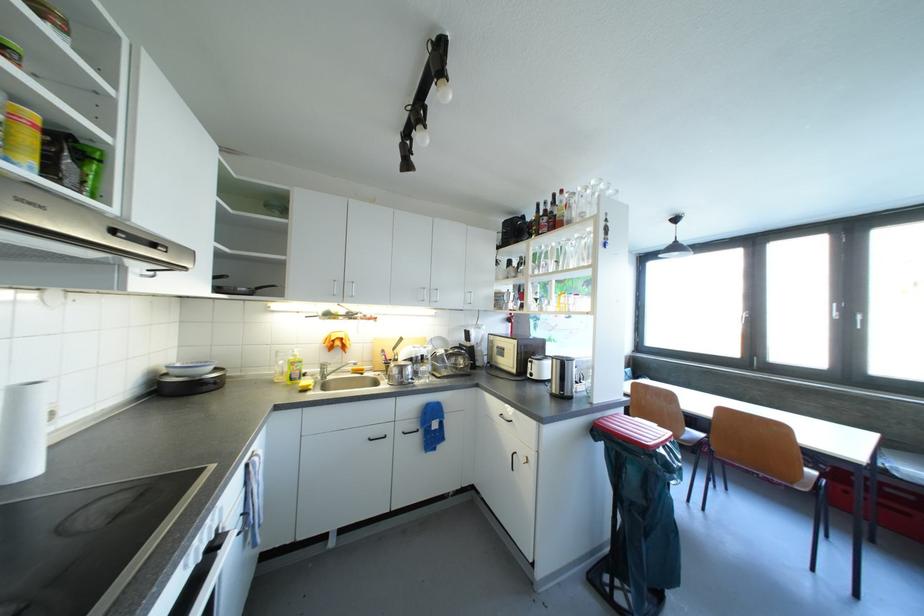
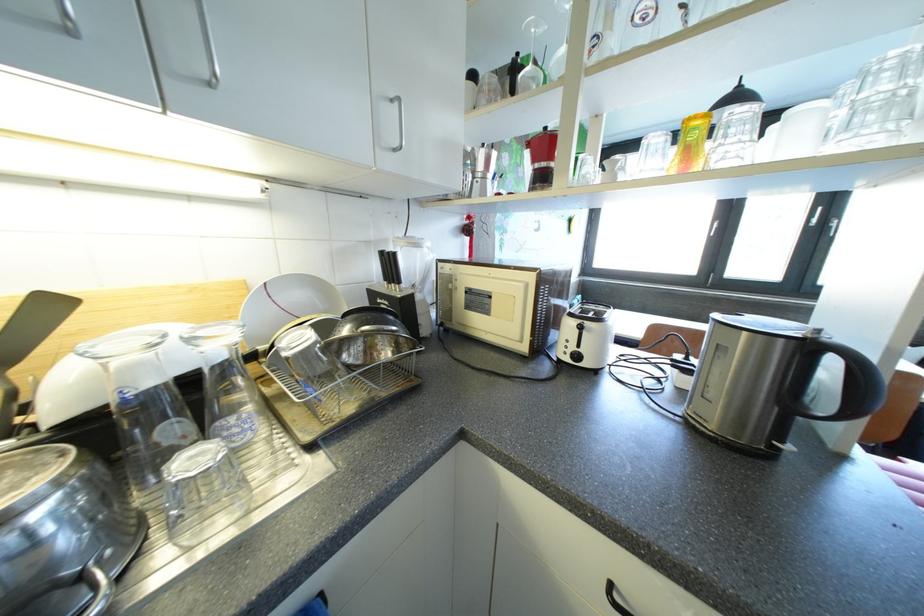
Question: In a continuous first-person perspective shot, in which direction is the camera moving?

Choices:
 (A) Left
 (B) Right
 (C) Forward
 (D) Backward

Answer: (C)